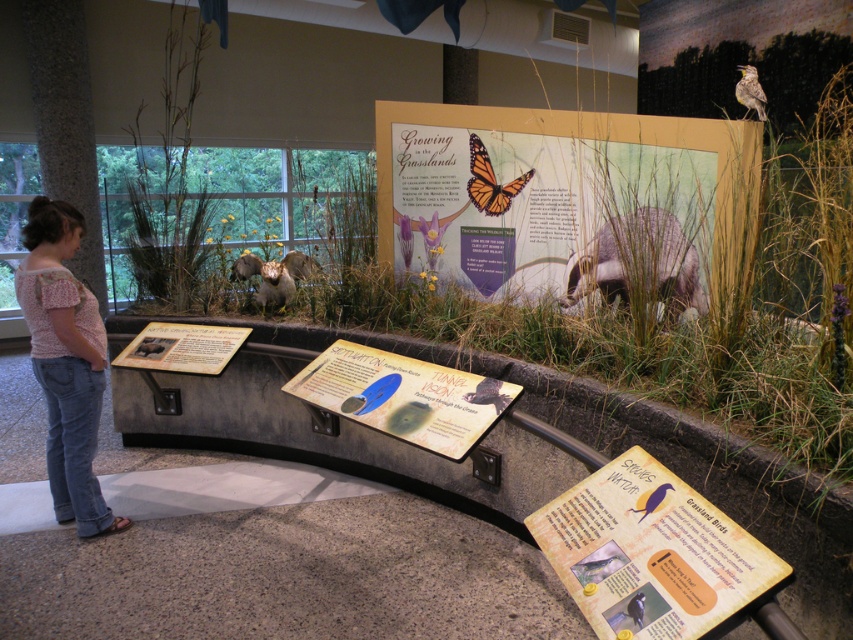
You are standing in front of the grassland exhibit and want to take a photo of both the point at [599,614] and the point at [300,397]. Which point will appear larger in your camera view?

The point at [599,614] will appear larger because it is closer to the camera than the point at [300,397].